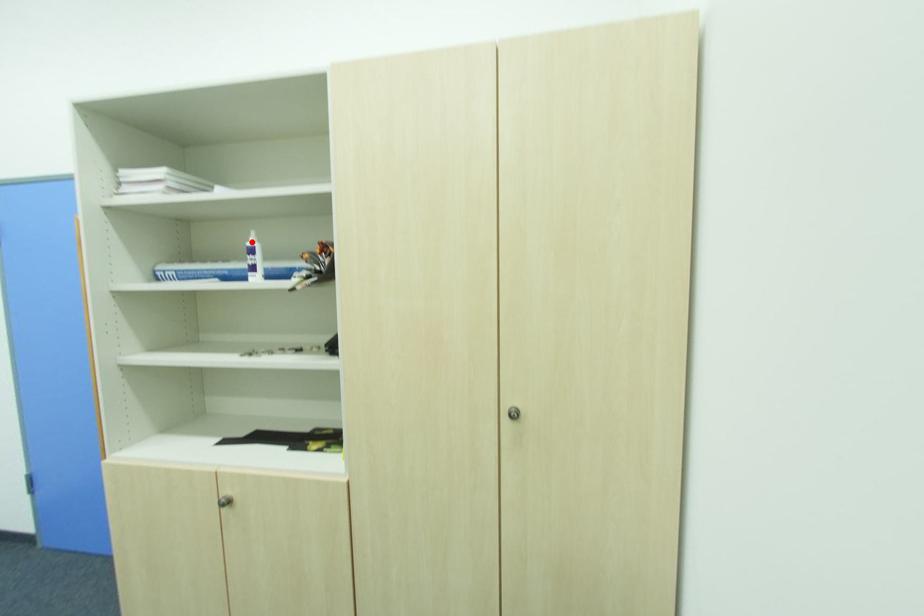
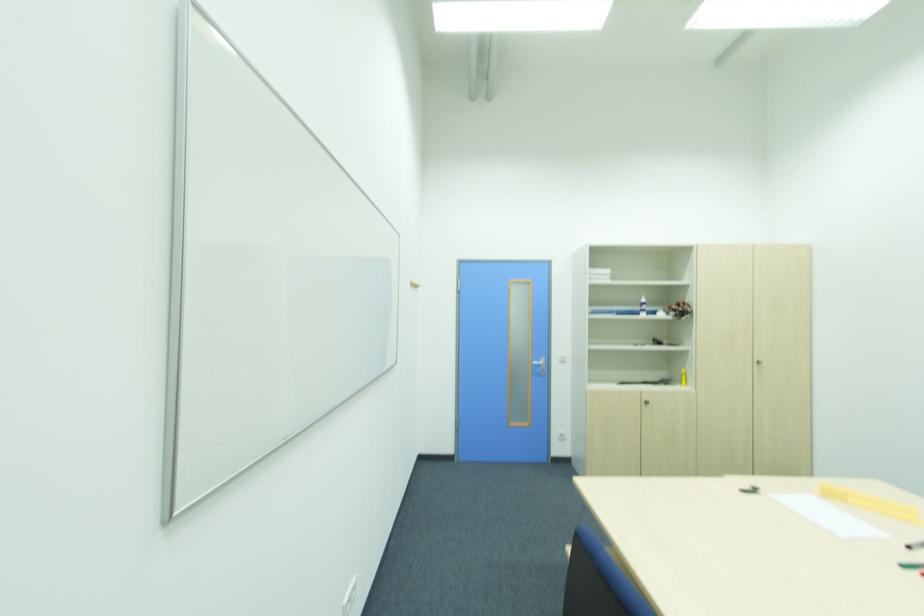
Where in the second image is the point corresponding to the highlighted location from the first image?

(643, 301)